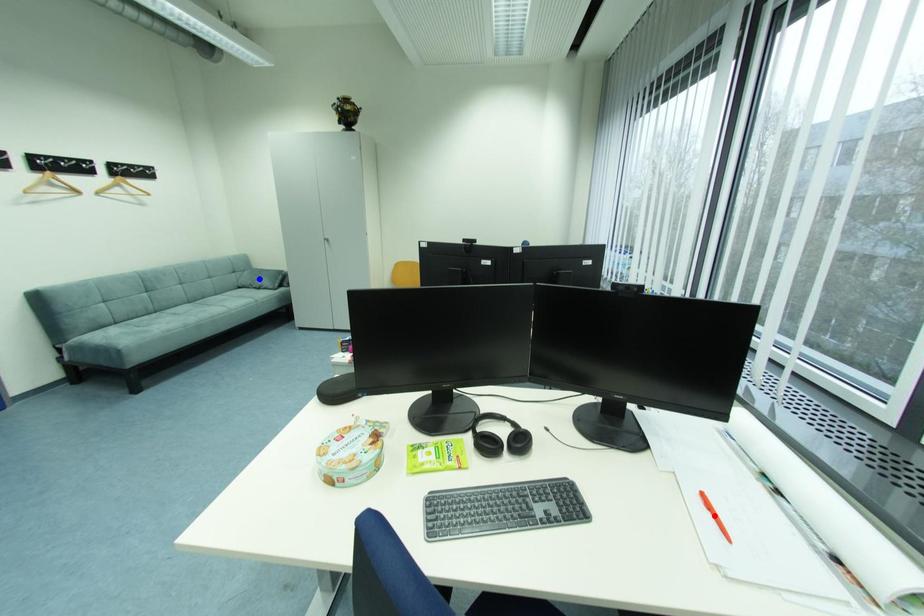
Question: In the image, two points are highlighted. Which point is nearer to the camera? Reply with the corresponding letter.

Choices:
 (A) blue point
 (B) red point

Answer: (B)